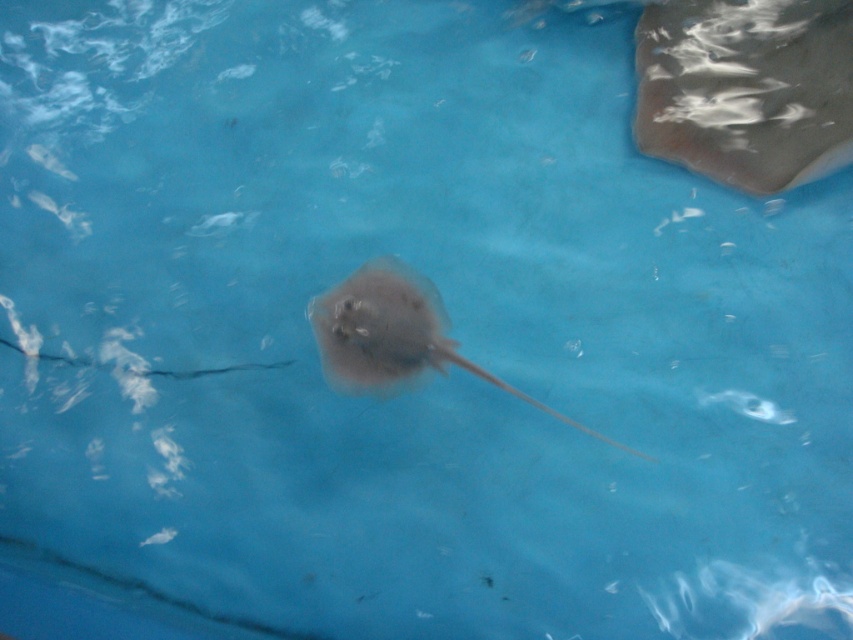
Question: Can you confirm if translucent rubber stingray at upper right is positioned below smooth gray stingray at center?

Choices:
 (A) no
 (B) yes

Answer: (A)

Question: Observing the image, what is the correct spatial positioning of translucent rubber stingray at upper right in reference to smooth gray stingray at center?

Choices:
 (A) above
 (B) below

Answer: (A)

Question: Among these points, which one is nearest to the camera?

Choices:
 (A) (643, 67)
 (B) (403, 323)

Answer: (B)

Question: In this image, where is translucent rubber stingray at upper right located relative to smooth gray stingray at center?

Choices:
 (A) above
 (B) below

Answer: (A)